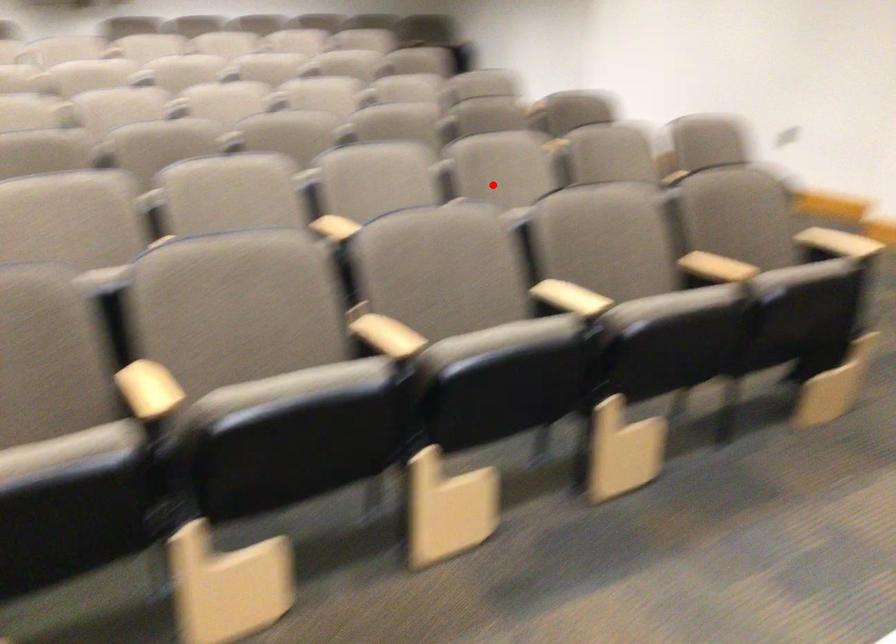
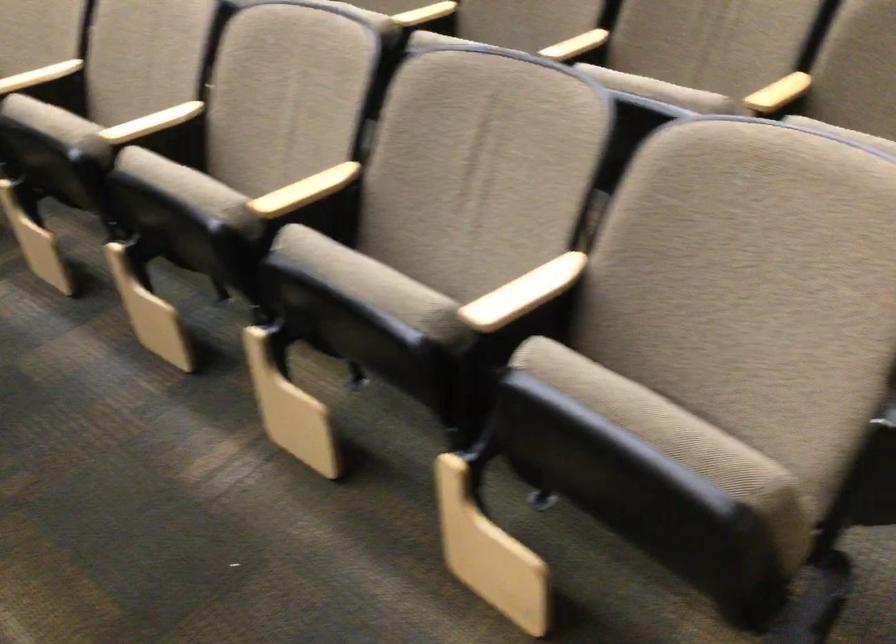
Question: I am providing you with two images of the same scene from different viewpoints. In image1, a red point is highlighted. Considering the same 3D point in image2, which of the following is correct?

Choices:
 (A) It is closer
 (B) It is farther

Answer: (A)